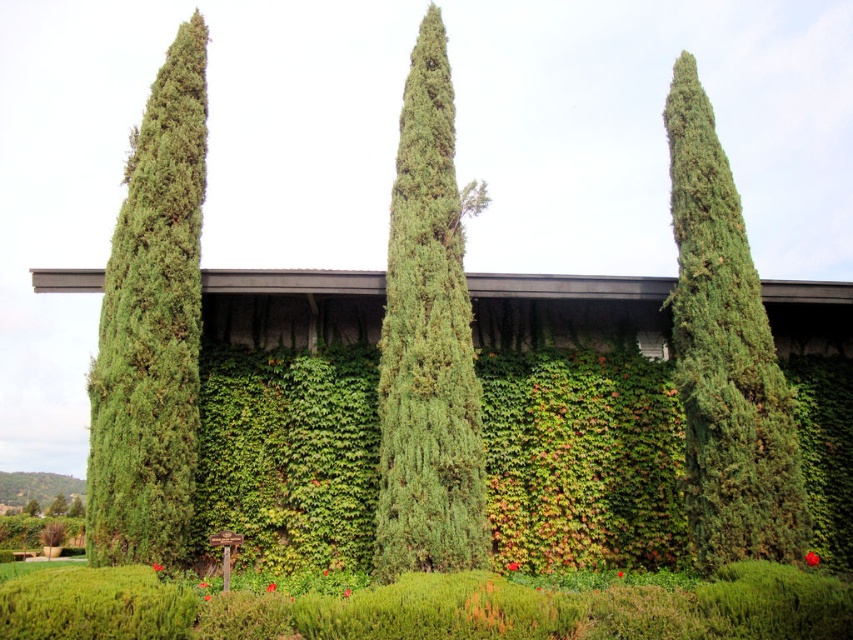
Does green textured tree at left appear under green leafy tree at center?

No, green textured tree at left is not below green leafy tree at center.

This screenshot has width=853, height=640. Describe the element at coordinates (151, 326) in the screenshot. I see `green textured tree at left` at that location.

Identify the location of green textured tree at left. coord(151,326).

Describe the element at coordinates (151, 326) in the screenshot. The image size is (853, 640). I see `green textured tree at left` at that location.

Is green textured tree at left taller than green textured tree at center?

In fact, green textured tree at left may be shorter than green textured tree at center.

Which is behind, point (190, 192) or point (386, 404)?

Positioned behind is point (190, 192).

At what (x,y) coordinates should I click in order to perform the action: click on green textured tree at left. Please return your answer as a coordinate pair (x, y). The image size is (853, 640). Looking at the image, I should click on (151, 326).

Is green textured tree at left to the left of green textured tree at right from the viewer's perspective?

Yes, green textured tree at left is to the left of green textured tree at right.

Who is lower down, green textured tree at left or green textured tree at right?

green textured tree at right is lower down.

Who is more distant from viewer, [149,112] or [766,403]?

The point [149,112] is more distant.

Find the location of a particular element. green textured tree at left is located at coordinates (151, 326).